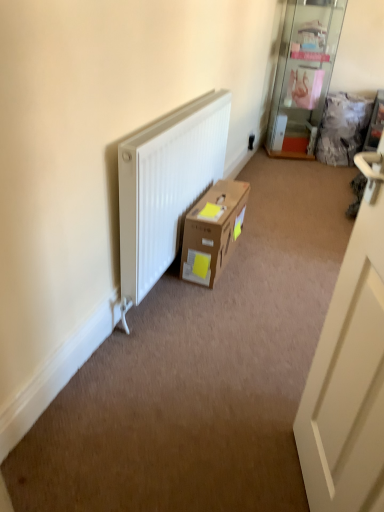
Question: Relative to brown cardboard box at center, is transparent glass shelf at upper right in front or behind?

Choices:
 (A) behind
 (B) front

Answer: (A)

Question: Would you say transparent glass shelf at upper right is inside or outside brown cardboard box at center?

Choices:
 (A) inside
 (B) outside

Answer: (B)

Question: Considering the real-world distances, which object is farthest from the transparent glass shelf at upper right?

Choices:
 (A) white matte door at right
 (B) brown cardboard box at center

Answer: (A)

Question: Which is farther from the brown cardboard box at center?

Choices:
 (A) transparent glass shelf at upper right
 (B) white matte door at right

Answer: (A)